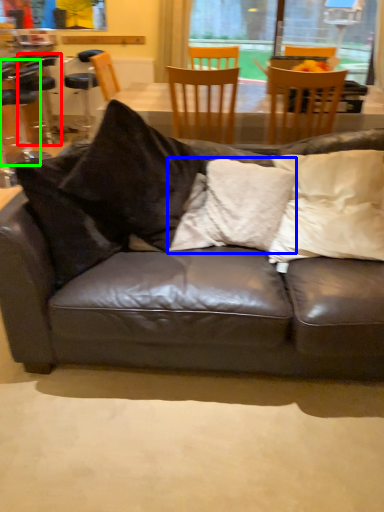
Question: Estimate the real-world distances between objects in this image. Which object is farther from bar stool (highlighted by a red box), pillow (highlighted by a blue box) or chair (highlighted by a green box)?

Choices:
 (A) pillow
 (B) chair

Answer: (A)